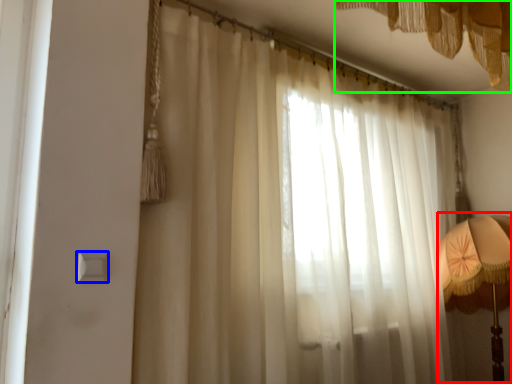
Question: Estimate the real-world distances between objects in this image. Which object is farther from bedside lamp (highlighted by a red box), light switch (highlighted by a blue box) or curtain (highlighted by a green box)?

Choices:
 (A) light switch
 (B) curtain

Answer: (A)